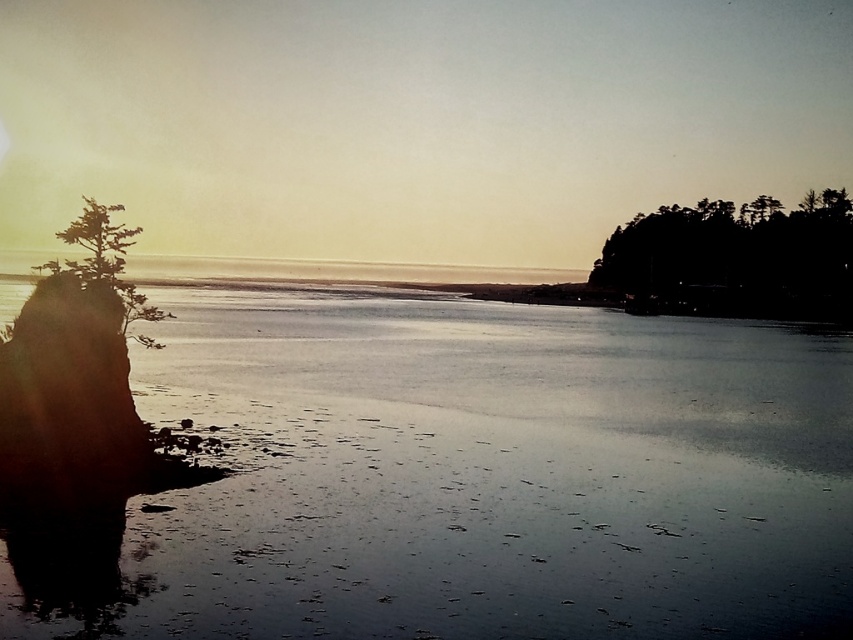
Question: From the image, what is the correct spatial relationship of smooth sand beach at left in relation to silhouette/black trees at right?

Choices:
 (A) above
 (B) below

Answer: (B)

Question: Which point is closer to the camera taking this photo?

Choices:
 (A) (488, 403)
 (B) (100, 244)

Answer: (B)

Question: From the image, what is the correct spatial relationship of silhouette/black trees at right in relation to green matte tree at left?

Choices:
 (A) right
 (B) left

Answer: (A)

Question: Which object is closer to the camera taking this photo?

Choices:
 (A) green matte tree at left
 (B) smooth sand beach at left
 (C) silhouette/black trees at right

Answer: (B)

Question: Which point is closer to the camera?

Choices:
 (A) (131, 314)
 (B) (712, 236)

Answer: (A)

Question: Can you confirm if smooth sand beach at left is wider than silhouette/black trees at right?

Choices:
 (A) no
 (B) yes

Answer: (B)